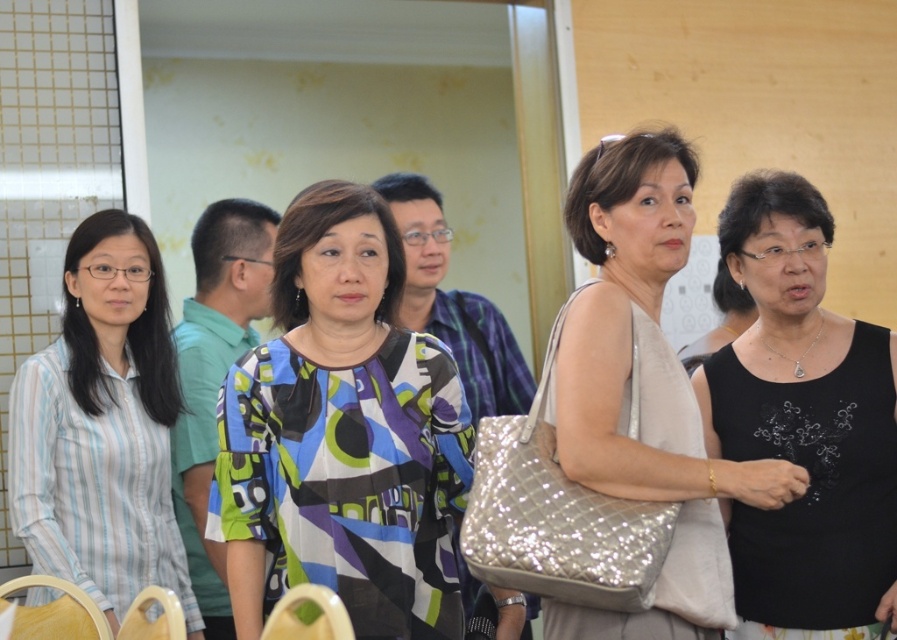
You are standing in the room and want to find the blue printed shirt at center. According to the coordinates provided, where should you look to locate it?

The blue printed shirt at center is located at coordinates point (x=215, y=374).

You are taking a photo of two points in the scene. The first point is at coordinate point(307, 540) and the second is at point(725, 218). Which point is closer to the camera?

Point(307, 540) is closer to the camera than point(725, 218).